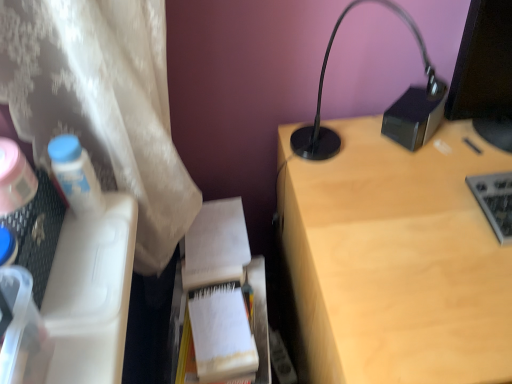
Where is `free space between black matte speaker at upper right and black metallic lamp at upper right`? The height and width of the screenshot is (384, 512). free space between black matte speaker at upper right and black metallic lamp at upper right is located at coordinates (385, 146).